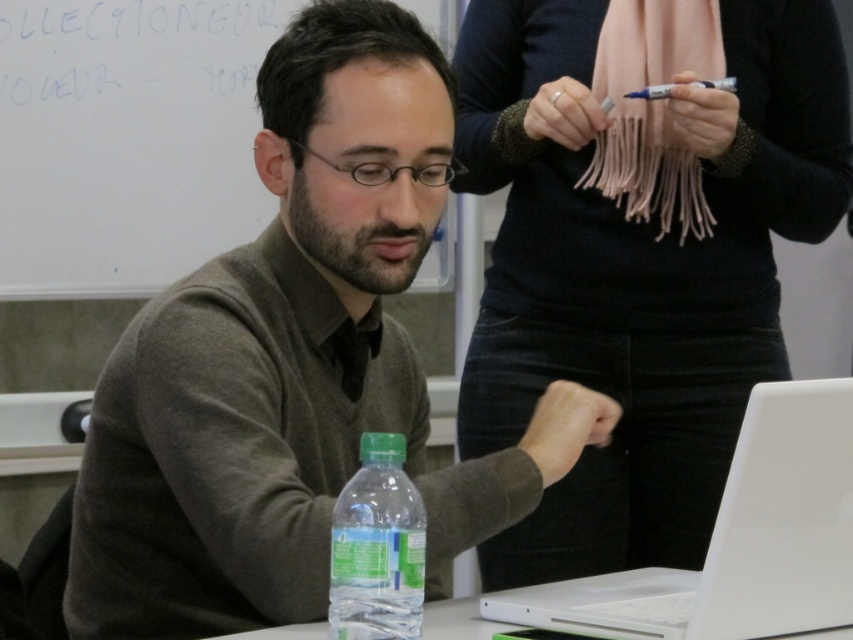
You are an interior designer assessing the space in the image. You need to determine if the matte gray sweater at center and the whiteboard at upper left can both fit on a shelf that is 1.2 meters wide. Can they fit together?

The matte gray sweater at center is bigger than the whiteboard at upper left. However, without knowing their exact sizes, it is impossible to determine if they can both fit on a 1.2 meter wide shelf.

You are a person who is 1.8 meters tall and standing in the classroom. You want to reach the whiteboard without moving your feet. Can you touch the matte gray sweater at center with your outstretched hand?

The matte gray sweater at center is 1.05 meters away from you. Since you are 1.8 meters tall, your outstretched hand can reach approximately up to 2.1 meters. Therefore, you can touch the matte gray sweater at center with your outstretched hand.